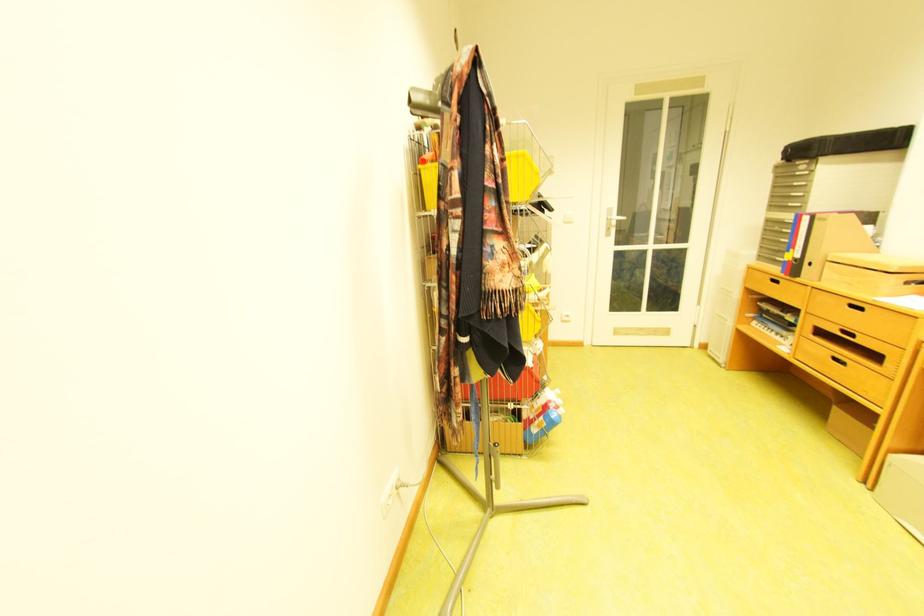
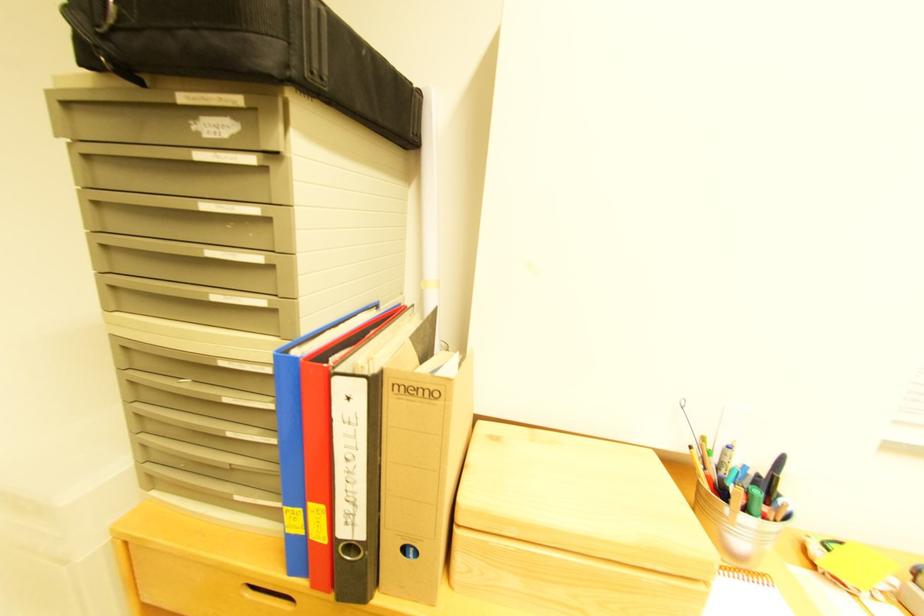
In the second image, find the point that corresponds to (796,222) in the first image.

(235, 363)